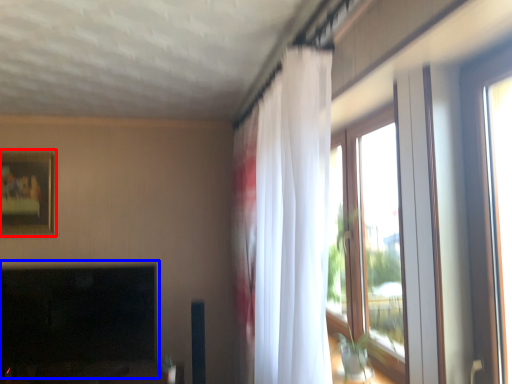
Question: Which object is further to the camera taking this photo, picture frame (highlighted by a red box) or fireplace (highlighted by a blue box)?

Choices:
 (A) picture frame
 (B) fireplace

Answer: (A)